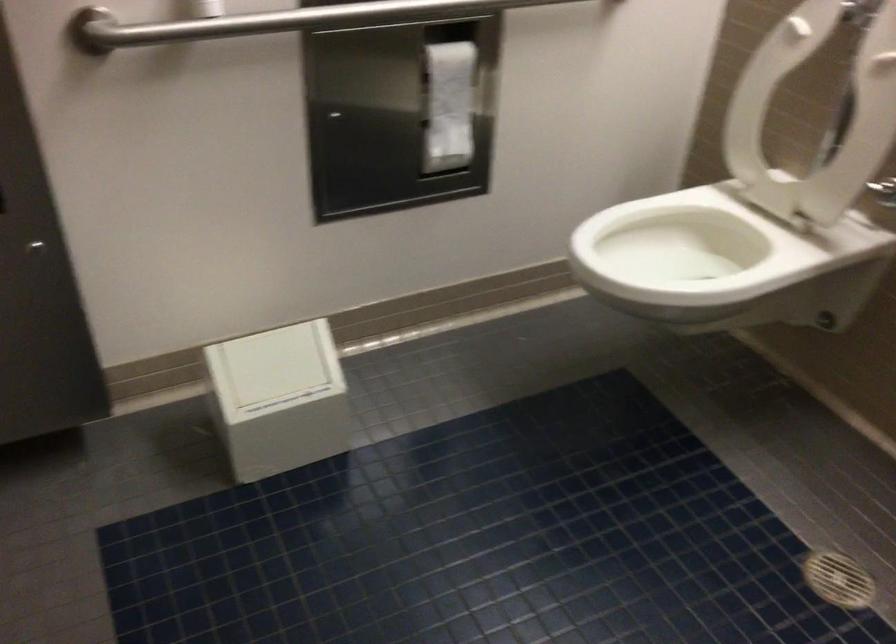
You are a GUI agent. You are given a task and a screenshot of the screen. Output one action in this format:
    pyautogui.click(x=<x>, y=<y>)
    Task: Click on the white toilet lid
    
    Given the screenshot: What is the action you would take?
    pyautogui.click(x=814, y=115)